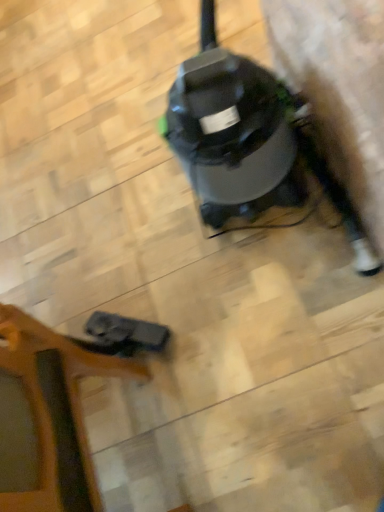
I want to click on wooden chair at lower left, so click(56, 410).

The width and height of the screenshot is (384, 512). Describe the element at coordinates (56, 410) in the screenshot. I see `wooden chair at lower left` at that location.

Find the location of a particular element. wooden chair at lower left is located at coordinates (56, 410).